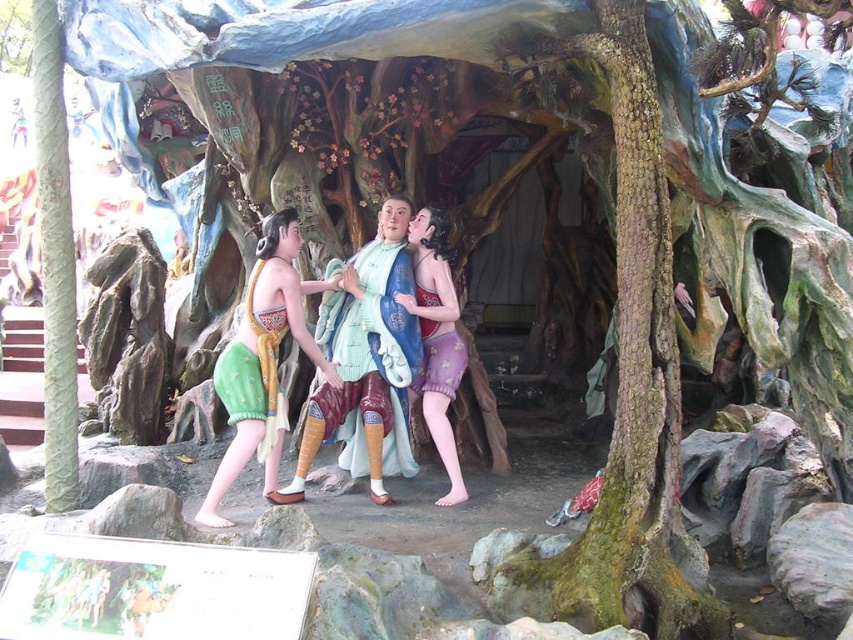
Question: Does green fabric skirt at center appear over matte purple fabric skirt at center?

Choices:
 (A) no
 (B) yes

Answer: (A)

Question: Among these points, which one is farthest from the camera?

Choices:
 (A) (424, 340)
 (B) (247, 353)

Answer: (A)

Question: Does matte green fabric dress at center lie behind matte purple fabric skirt at center?

Choices:
 (A) no
 (B) yes

Answer: (A)

Question: Which point appears farthest from the camera in this image?

Choices:
 (A) (454, 300)
 (B) (263, 292)

Answer: (A)

Question: Which is nearer to the green fabric skirt at center?

Choices:
 (A) matte green fabric dress at center
 (B) matte purple fabric skirt at center

Answer: (A)

Question: Can you confirm if matte green fabric dress at center is positioned to the left of green fabric skirt at center?

Choices:
 (A) no
 (B) yes

Answer: (A)